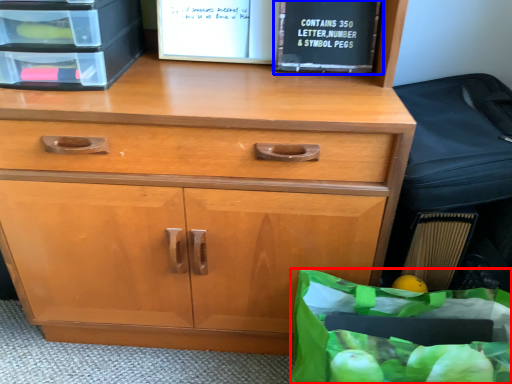
Question: Among these objects, which one is nearest to the camera, grocery bag (highlighted by a red box) or paperback book (highlighted by a blue box)?

Choices:
 (A) grocery bag
 (B) paperback book

Answer: (A)